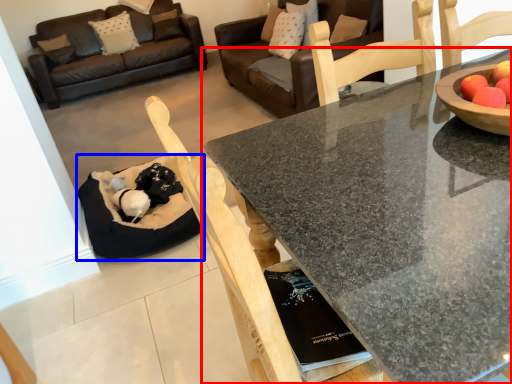
Question: Among these objects, which one is nearest to the camera, coffee table (highlighted by a red box) or cat bed (highlighted by a blue box)?

Choices:
 (A) coffee table
 (B) cat bed

Answer: (A)